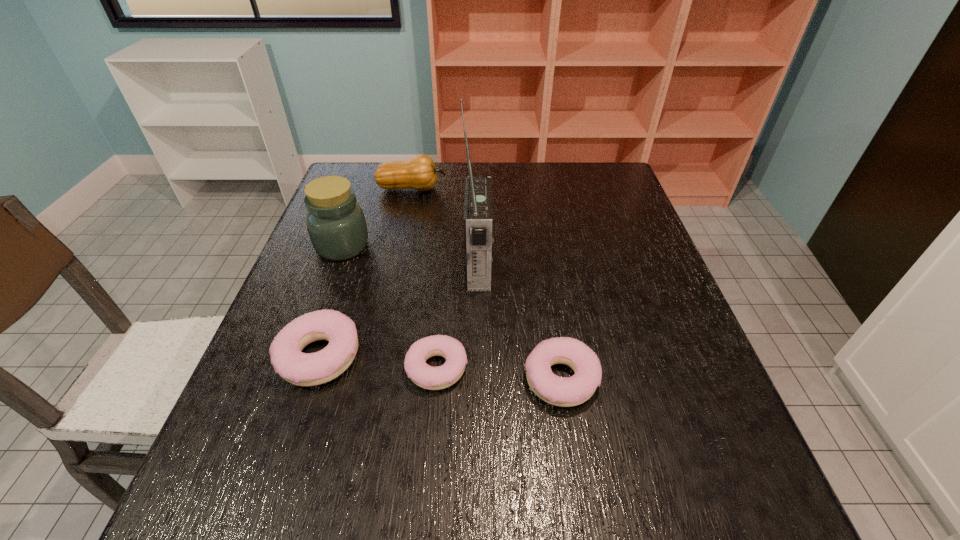
Where is `vacant spot to place a doughnut on the right`? vacant spot to place a doughnut on the right is located at coordinates (690, 392).